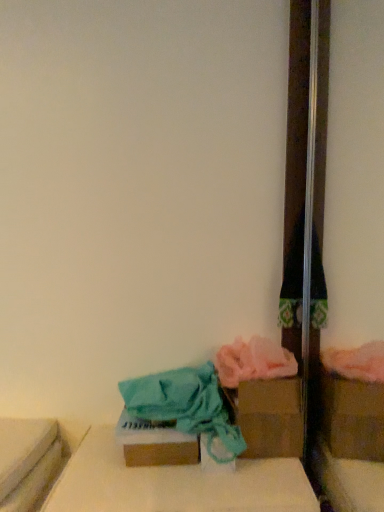
Question: Would you say cardboard box at lower center is outside brown cardboard box at lower center, the first storage box from the left?

Choices:
 (A) yes
 (B) no

Answer: (A)

Question: Is cardboard box at lower center closer to the viewer compared to brown cardboard box at lower center, the first storage box from the left?

Choices:
 (A) yes
 (B) no

Answer: (A)

Question: Is cardboard box at lower center at the right side of brown cardboard box at lower center, acting as the 2th storage box starting from the right?

Choices:
 (A) yes
 (B) no

Answer: (A)

Question: Is cardboard box at lower center wider than brown cardboard box at lower center, placed as the first storage box when sorted from front to back?

Choices:
 (A) yes
 (B) no

Answer: (A)

Question: Can you confirm if cardboard box at lower center is bigger than brown cardboard box at lower center, the 2th storage box when ordered from back to front?

Choices:
 (A) no
 (B) yes

Answer: (B)

Question: Considering the relative sizes of cardboard box at lower center and brown cardboard box at lower center, acting as the 2th storage box starting from the right, in the image provided, is cardboard box at lower center taller than brown cardboard box at lower center, acting as the 2th storage box starting from the right,?

Choices:
 (A) yes
 (B) no

Answer: (B)

Question: Are cardboard box at lower center and brown cardboard box at lower right, the first storage box positioned from the back, beside each other?

Choices:
 (A) yes
 (B) no

Answer: (B)

Question: From a real-world perspective, is cardboard box at lower center under brown cardboard box at lower right, the second storage box positioned from the front?

Choices:
 (A) yes
 (B) no

Answer: (A)

Question: Is cardboard box at lower center to the right of brown cardboard box at lower right, the second storage box positioned from the front, from the viewer's perspective?

Choices:
 (A) no
 (B) yes

Answer: (A)

Question: Does cardboard box at lower center have a greater width compared to brown cardboard box at lower right, which appears as the first storage box when viewed from the right?

Choices:
 (A) no
 (B) yes

Answer: (B)

Question: Is the position of cardboard box at lower center more distant than that of brown cardboard box at lower right, the second storage box positioned from the left?

Choices:
 (A) yes
 (B) no

Answer: (B)

Question: Is cardboard box at lower center not close to brown cardboard box at lower right, the second storage box positioned from the left?

Choices:
 (A) yes
 (B) no

Answer: (B)

Question: Could you tell me if brown cardboard box at lower right, the second storage box positioned from the left, is turned towards brown cardboard box at lower center, placed as the first storage box when sorted from front to back?

Choices:
 (A) yes
 (B) no

Answer: (B)